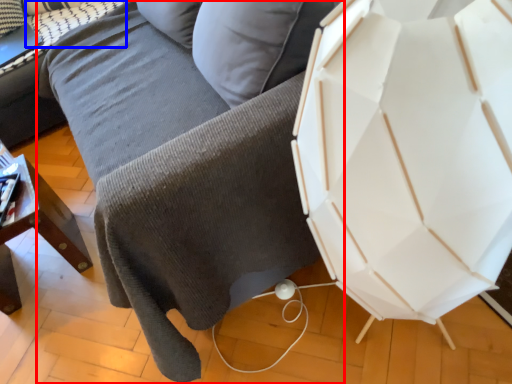
Question: Among these objects, which one is farthest to the camera, studio couch (highlighted by a red box) or pillow (highlighted by a blue box)?

Choices:
 (A) studio couch
 (B) pillow

Answer: (B)